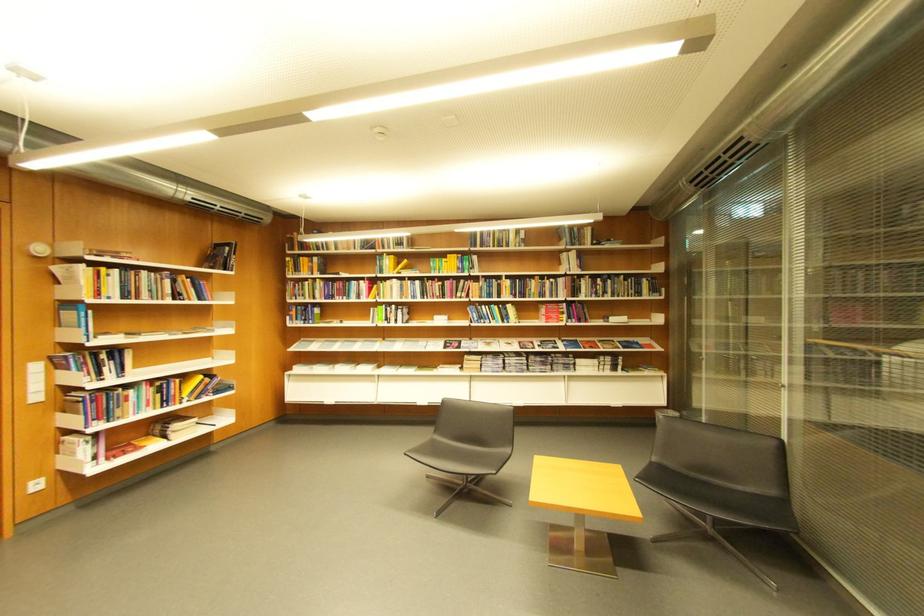
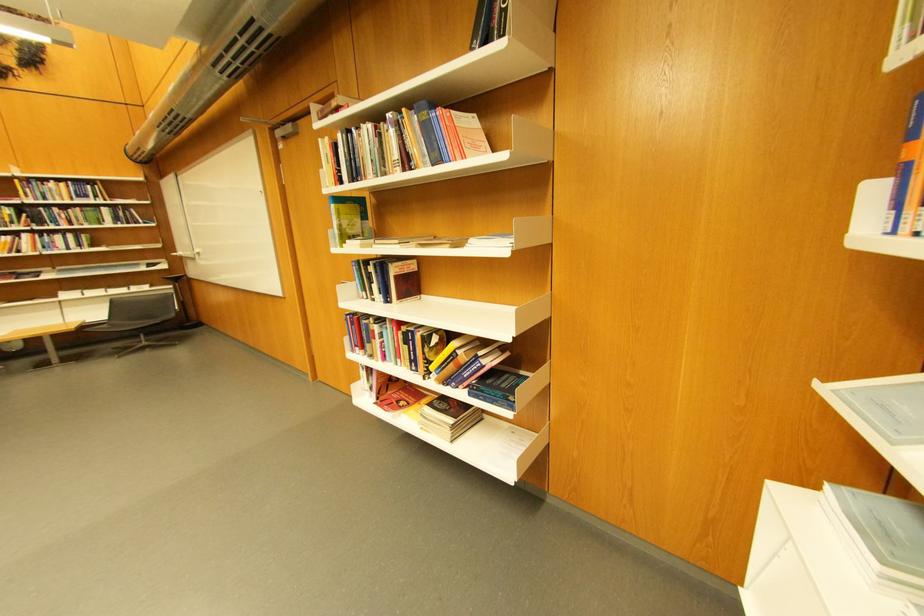
The point at (148, 277) is marked in the first image. Where is the corresponding point in the second image?

(370, 137)